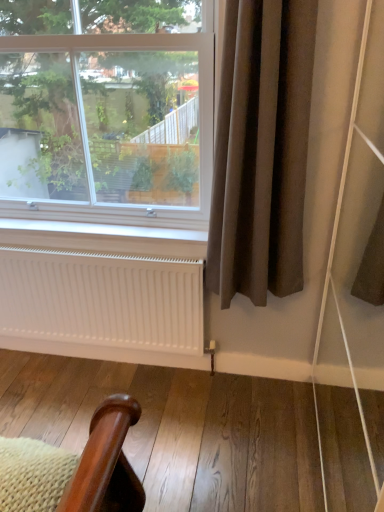
At what (x,y) coordinates should I click in order to perform the action: click on free point below white matte radiator at lower center (from a real-world perspective). Please return your answer as a coordinate pair (x, y). This screenshot has width=384, height=512. Looking at the image, I should click on (95, 362).